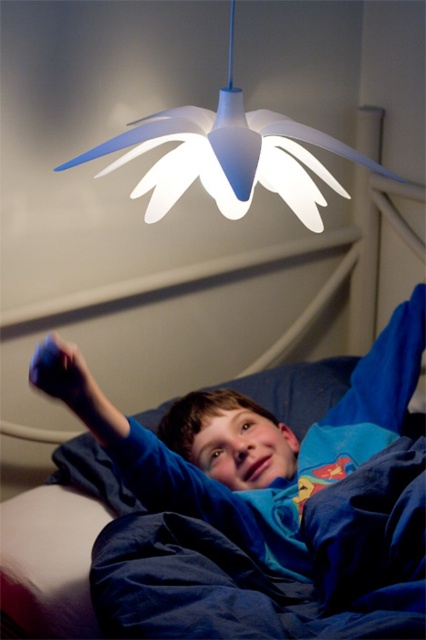
Question: Is blue cotton shirt at lower center to the left of blue fabric pillow at lower center from the viewer's perspective?

Choices:
 (A) yes
 (B) no

Answer: (B)

Question: Does blue cotton shirt at lower center appear under white matte/porcelain flower at upper center?

Choices:
 (A) yes
 (B) no

Answer: (A)

Question: Which point is closer to the camera?

Choices:
 (A) (340, 420)
 (B) (236, 212)
 (C) (86, 470)

Answer: (B)

Question: Among these objects, which one is farthest from the camera?

Choices:
 (A) white matte/porcelain flower at upper center
 (B) blue cotton shirt at lower center

Answer: (B)

Question: Can you confirm if white matte/porcelain flower at upper center is wider than blue fabric pillow at lower center?

Choices:
 (A) yes
 (B) no

Answer: (B)

Question: Which of the following is the closest to the observer?

Choices:
 (A) (340, 150)
 (B) (126, 502)

Answer: (A)